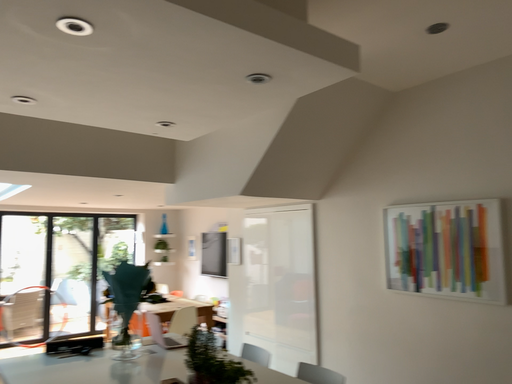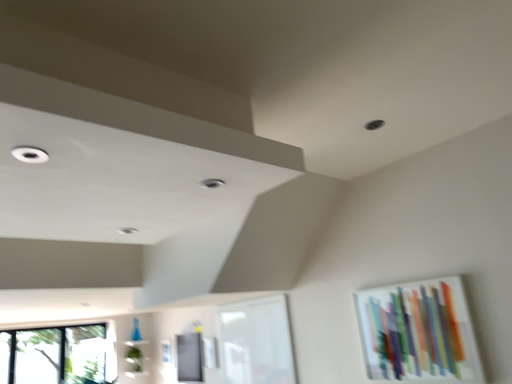
Question: Which way did the camera rotate in the video?

Choices:
 (A) rotated upward
 (B) rotated downward

Answer: (A)